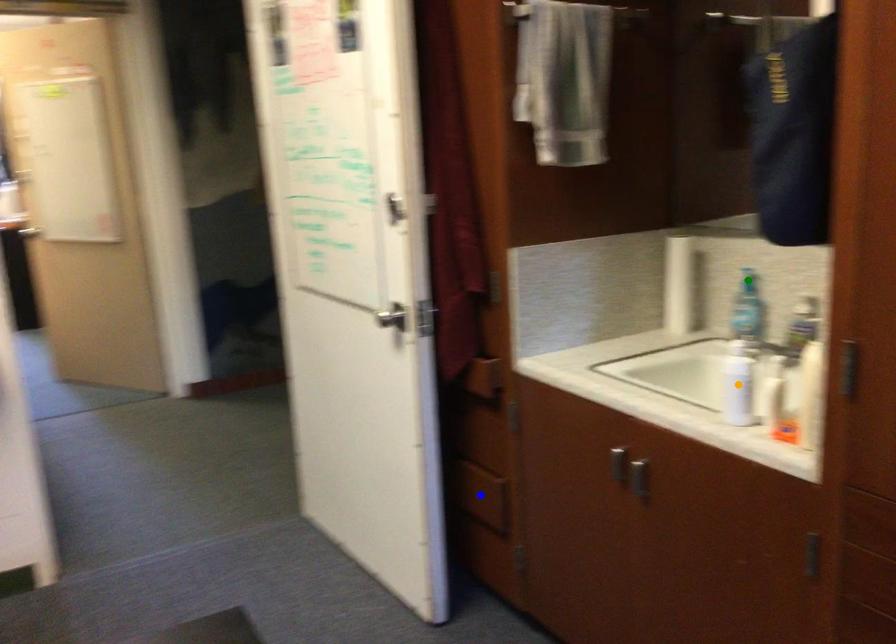
Order these from farthest to nearest:
- green point
- orange point
- blue point

blue point
green point
orange point